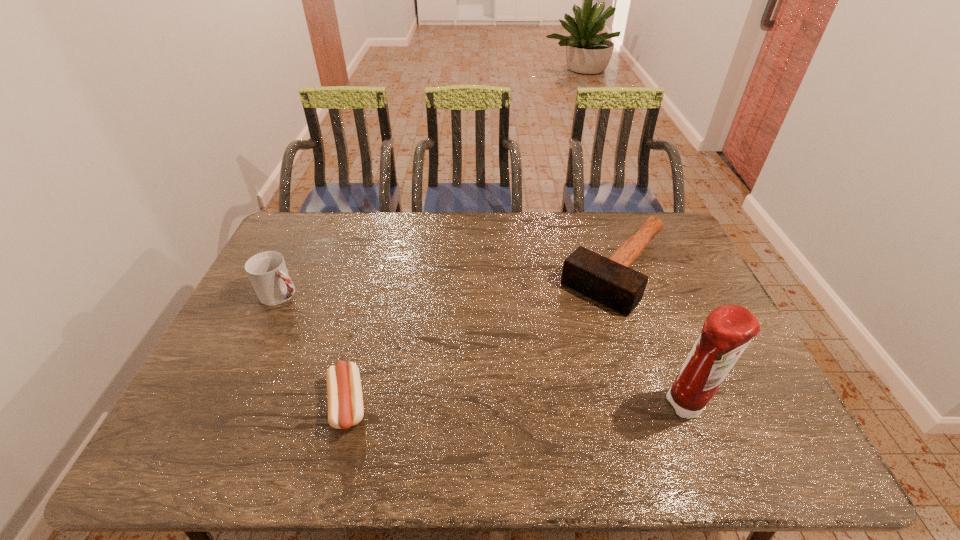
Find the location of a particular element. Image resolution: width=960 pixels, height=540 pixels. the second object from left to right is located at coordinates (344, 392).

Locate an element on the screen. This screenshot has width=960, height=540. sausage is located at coordinates (344, 392).

Where is `condiment`? The height and width of the screenshot is (540, 960). condiment is located at coordinates (727, 331).

You are a GUI agent. You are given a task and a screenshot of the screen. Output one action in this format:
    pyautogui.click(x=<x>, y=<y>)
    Task: Click on the third tallest object
    
    Given the screenshot: What is the action you would take?
    pyautogui.click(x=609, y=281)

At what (x,y) coordinates should I click in order to perform the action: click on the leftmost object. Please return your answer as a coordinate pair (x, y). This screenshot has height=540, width=960. Looking at the image, I should click on (267, 271).

Where is `the second tallest object`? The width and height of the screenshot is (960, 540). the second tallest object is located at coordinates (267, 271).

Where is `free space located 0.310m on the left of the shortest object`? The height and width of the screenshot is (540, 960). free space located 0.310m on the left of the shortest object is located at coordinates (198, 405).

The width and height of the screenshot is (960, 540). What are the coordinates of `vacant space located 0.120m on the right of the tallest object` in the screenshot? It's located at (761, 406).

Where is `free space located 0.300m on the striking face of the second shortest object`? Image resolution: width=960 pixels, height=540 pixels. free space located 0.300m on the striking face of the second shortest object is located at coordinates (531, 368).

Find the location of a particular element. vacant region located 0.300m on the striking face of the second shortest object is located at coordinates (531, 368).